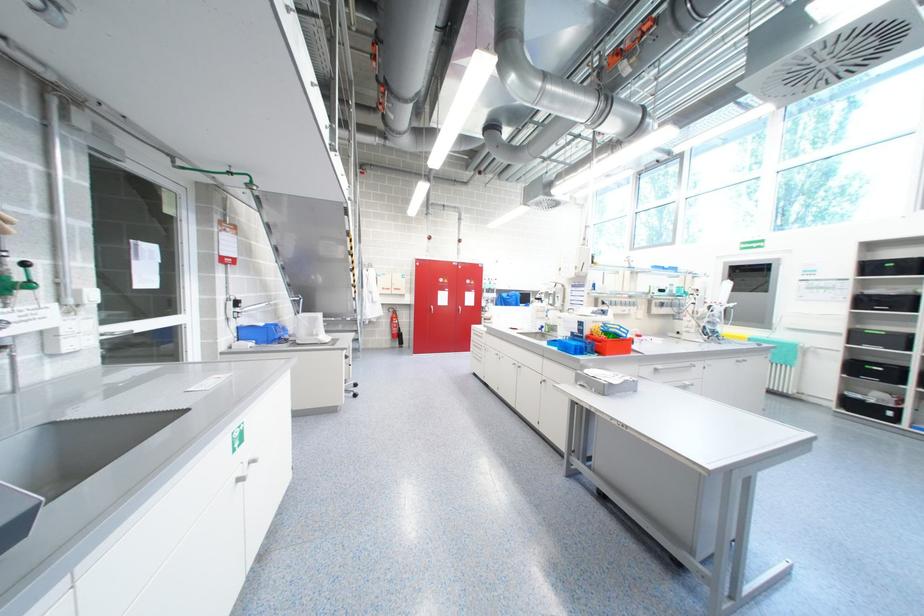
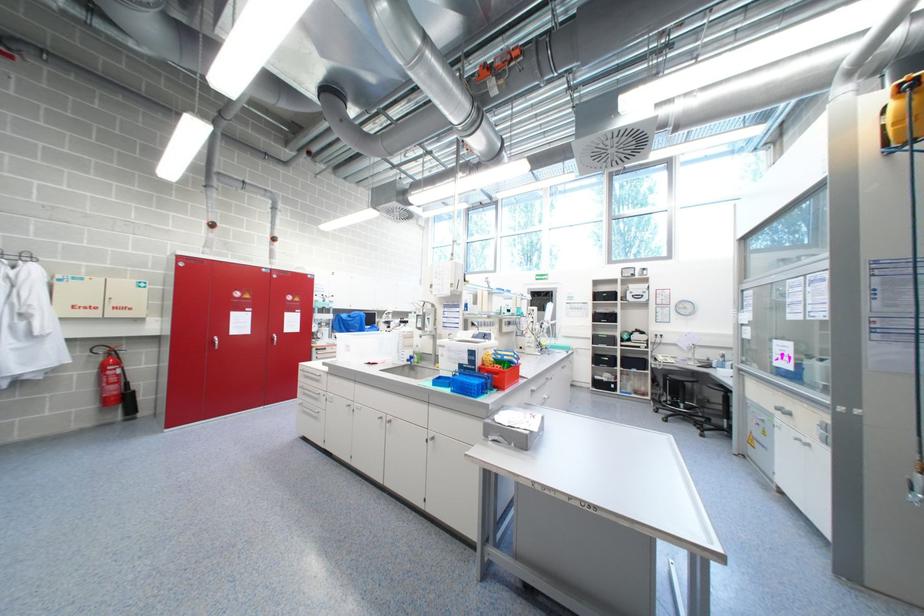
Question: The camera is either moving clockwise (left) or counter-clockwise (right) around the object. The first image is from the beginning of the video and the second image is from the end. Is the camera moving left or right when shooting the video?

Choices:
 (A) Left
 (B) Right

Answer: (A)